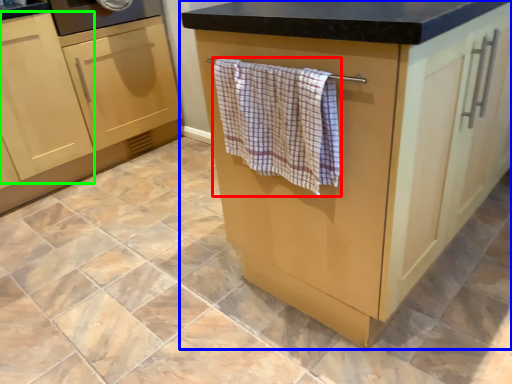
Question: Which object is positioned farthest from bath towel (highlighted by a red box)? Select from cabinetry (highlighted by a blue box) and cabinetry (highlighted by a green box).

Choices:
 (A) cabinetry
 (B) cabinetry

Answer: (B)